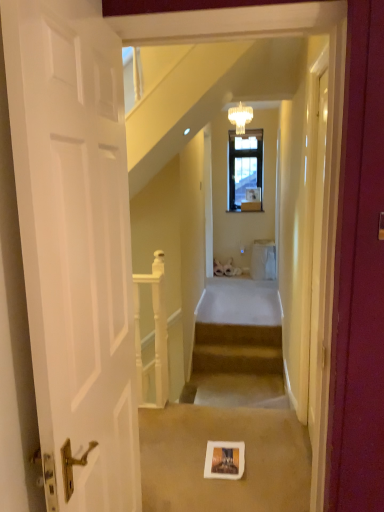
Question: Considering the relative sizes of white wooden railing at center and carpeted stairs at center in the image provided, is white wooden railing at center wider than carpeted stairs at center?

Choices:
 (A) yes
 (B) no

Answer: (A)

Question: Is carpeted stairs at center a part of white wooden railing at center?

Choices:
 (A) no
 (B) yes

Answer: (A)

Question: Would you say white wooden railing at center is a long distance from carpeted stairs at center?

Choices:
 (A) no
 (B) yes

Answer: (B)

Question: Is white wooden railing at center behind carpeted stairs at center?

Choices:
 (A) yes
 (B) no

Answer: (B)

Question: Considering the relative sizes of white wooden railing at center and carpeted stairs at center in the image provided, is white wooden railing at center smaller than carpeted stairs at center?

Choices:
 (A) yes
 (B) no

Answer: (B)

Question: Can you confirm if white wooden railing at center is positioned to the left of carpeted stairs at center?

Choices:
 (A) no
 (B) yes

Answer: (B)

Question: Is the surface of crystal glass chandelier at upper center in direct contact with white cardboard picture frame at center?

Choices:
 (A) no
 (B) yes

Answer: (A)

Question: Would you say white cardboard picture frame at center is part of crystal glass chandelier at upper center's contents?

Choices:
 (A) yes
 (B) no

Answer: (B)

Question: Is crystal glass chandelier at upper center not within white cardboard picture frame at center?

Choices:
 (A) no
 (B) yes

Answer: (B)

Question: Would you say crystal glass chandelier at upper center is a long distance from white cardboard picture frame at center?

Choices:
 (A) no
 (B) yes

Answer: (B)

Question: Does crystal glass chandelier at upper center have a lesser height compared to white cardboard picture frame at center?

Choices:
 (A) no
 (B) yes

Answer: (A)

Question: Is crystal glass chandelier at upper center positioned with its back to white cardboard picture frame at center?

Choices:
 (A) yes
 (B) no

Answer: (B)

Question: Considering the relative sizes of carpeted stairs at center and white cardboard picture frame at center in the image provided, is carpeted stairs at center shorter than white cardboard picture frame at center?

Choices:
 (A) yes
 (B) no

Answer: (B)